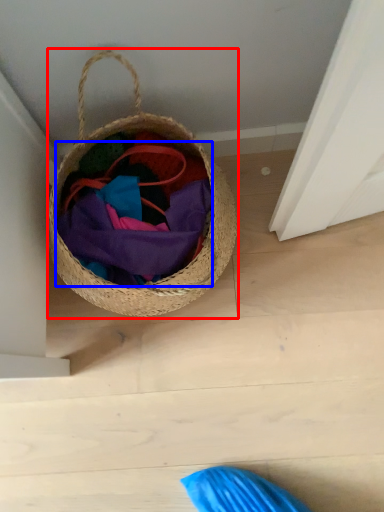
Question: Which object appears closest to the camera in this image, picnic basket (highlighted by a red box) or bag (highlighted by a blue box)?

Choices:
 (A) picnic basket
 (B) bag

Answer: (A)